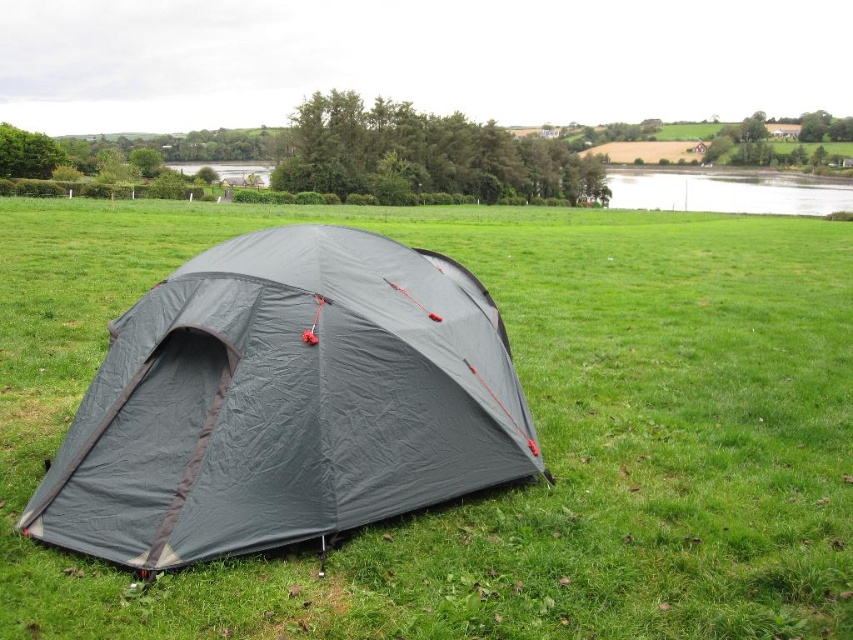
Question: Is dark gray fabric tent at center bigger than smooth water at upper right?

Choices:
 (A) no
 (B) yes

Answer: (A)

Question: Does dark gray fabric tent at center have a greater width compared to smooth water at upper right?

Choices:
 (A) no
 (B) yes

Answer: (A)

Question: Which of the following is the closest to the observer?

Choices:
 (A) (426, 451)
 (B) (813, 189)

Answer: (A)

Question: Does dark gray fabric tent at center come behind smooth water at upper right?

Choices:
 (A) yes
 (B) no

Answer: (B)